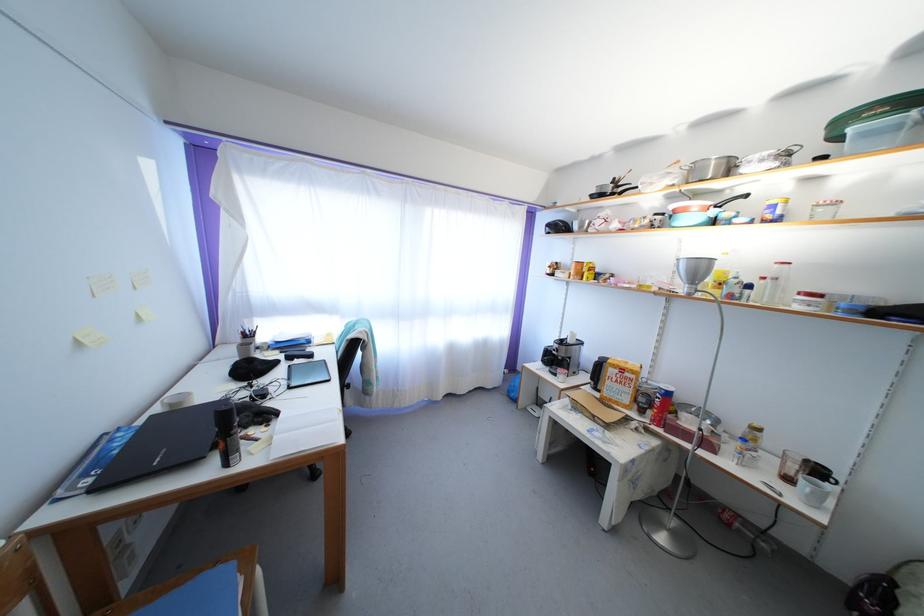
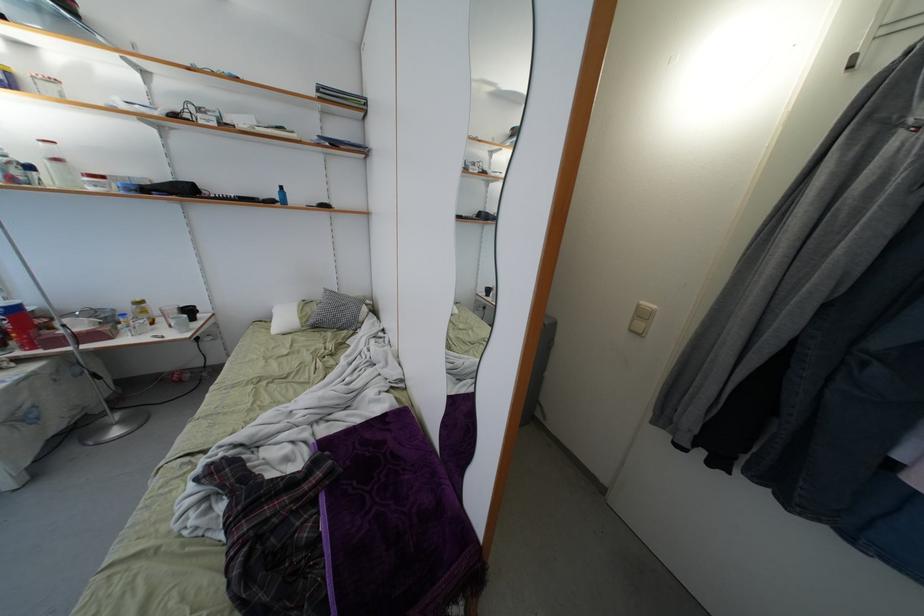
The point at (663, 410) is marked in the first image. Where is the corresponding point in the second image?

(22, 333)